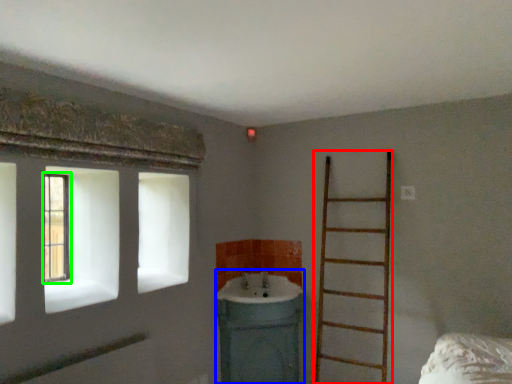
Question: Which is farther away from ladder (highlighted by a red box)? sink (highlighted by a blue box) or window (highlighted by a green box)?

Choices:
 (A) sink
 (B) window

Answer: (B)